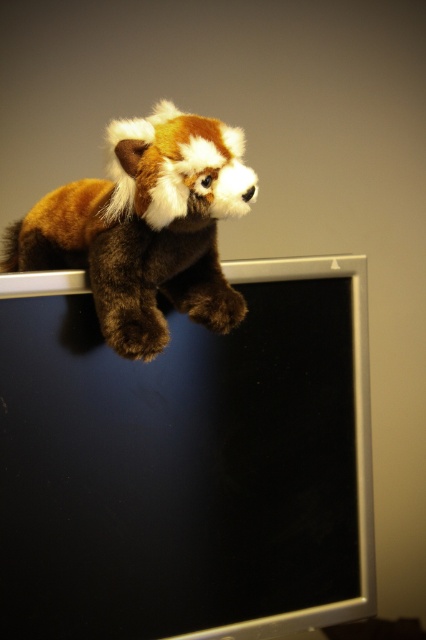
You are setting up a desk and want to place both the black matte computer monitor at upper left and the brown plush toy at upper left on the desk. Based on their sizes, which object should you place first to ensure they both fit on the desk?

The black matte computer monitor at upper left is taller than the brown plush toy at upper left, so you should place the taller monitor first to ensure there is enough space for both objects on the desk.

You are a delivery person who needs to place a new keyboard that is 7 inches long on the desk. The desk has the black matte computer monitor at upper left and the brown plush toy at upper left. Can you fit the keyboard between them without moving the existing items?

The black matte computer monitor at upper left and the brown plush toy at upper left are 6.65 inches apart. Since the keyboard is 7 inches long, it cannot fit between them as the space is smaller than the keyboard.

You are setting up a new computer desk and need to place a black matte computer monitor at upper left. According to the image, where should you position it in terms of coordinates?

The black matte computer monitor at upper left should be positioned at coordinates approximately 0.723 in the x axis and 0.441 in the y axis.